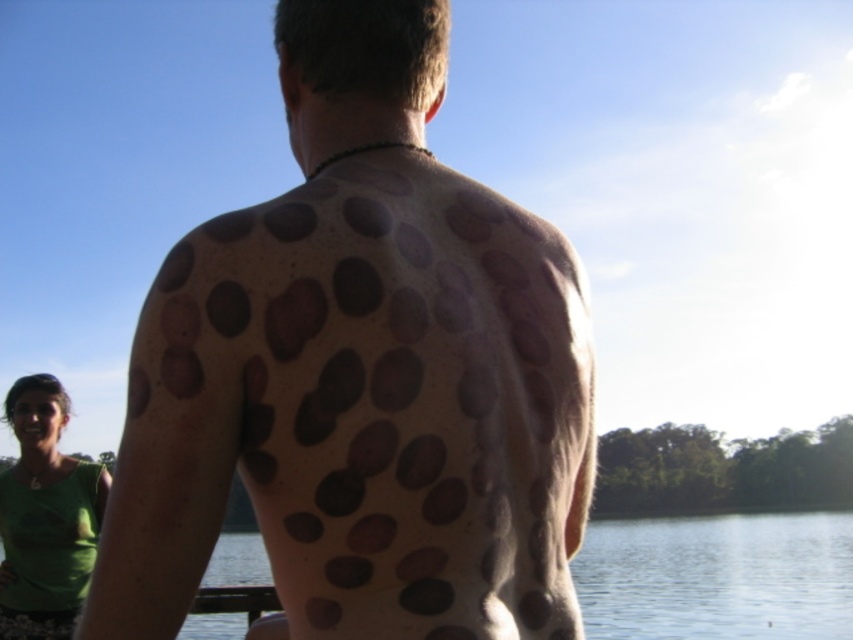
Question: Which is nearer to the brown textured spots at back?

Choices:
 (A) green fabric shirt at lower left
 (B) transparent water at lower center

Answer: (A)

Question: Is transparent water at lower center above green fabric shirt at lower left?

Choices:
 (A) yes
 (B) no

Answer: (B)

Question: Which object is positioned farthest from the transparent water at lower center?

Choices:
 (A) brown textured spots at back
 (B) green fabric shirt at lower left

Answer: (A)

Question: Among these objects, which one is farthest from the camera?

Choices:
 (A) brown textured spots at back
 (B) green fabric shirt at lower left
 (C) transparent water at lower center

Answer: (B)

Question: From the image, what is the correct spatial relationship of brown textured spots at back in relation to green fabric shirt at lower left?

Choices:
 (A) below
 (B) above

Answer: (B)

Question: In this image, where is brown textured spots at back located relative to transparent water at lower center?

Choices:
 (A) below
 (B) above

Answer: (B)